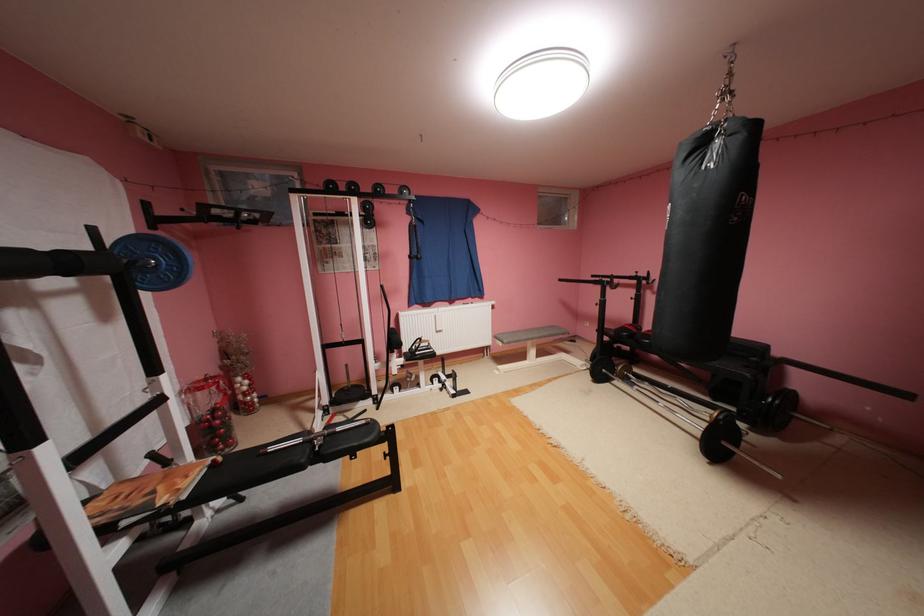
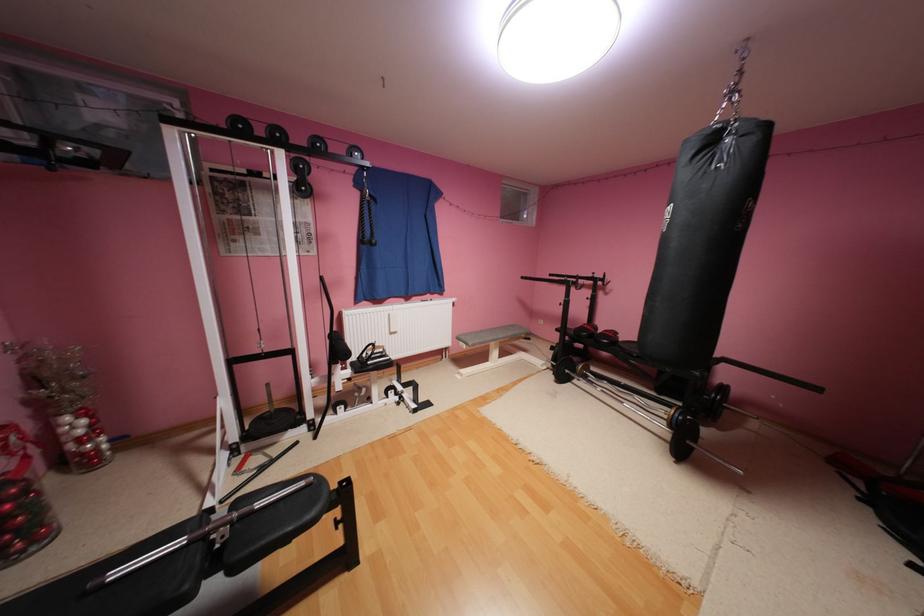
Question: The images are taken continuously from a first-person perspective. In which direction is your viewpoint rotating?

Choices:
 (A) Left
 (B) Right
 (C) Up
 (D) Down

Answer: (B)